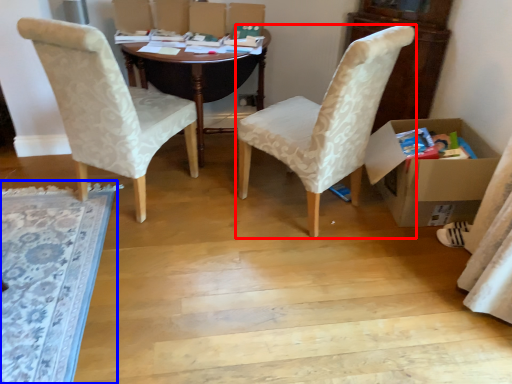
Question: Which point is further to the camera, chair (highlighted by a red box) or mat (highlighted by a blue box)?

Choices:
 (A) chair
 (B) mat

Answer: (A)